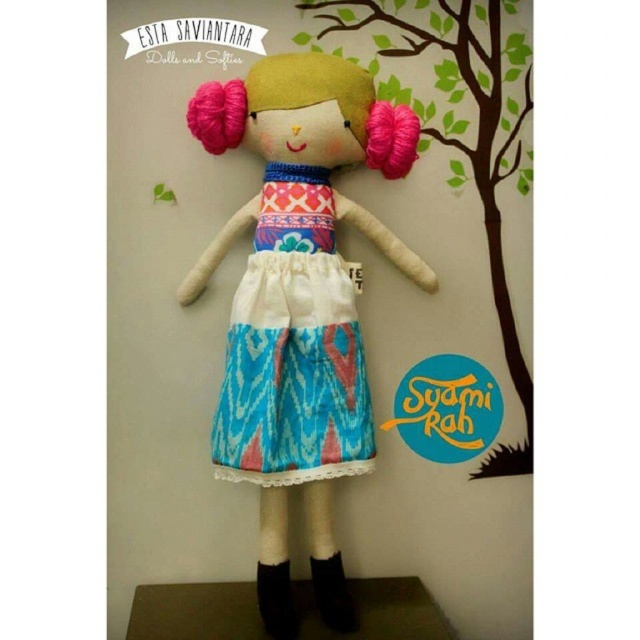
Question: Can you confirm if textured fabric doll at center is positioned below blue ikat apron at center?

Choices:
 (A) yes
 (B) no

Answer: (A)

Question: Which point is farther to the camera?

Choices:
 (A) textured fabric doll at center
 (B) blue ikat apron at center

Answer: (B)

Question: Can you confirm if textured fabric doll at center is smaller than blue ikat apron at center?

Choices:
 (A) no
 (B) yes

Answer: (A)

Question: Among these objects, which one is nearest to the camera?

Choices:
 (A) textured fabric doll at center
 (B) blue ikat apron at center

Answer: (A)

Question: From the image, what is the correct spatial relationship of textured fabric doll at center in relation to blue ikat apron at center?

Choices:
 (A) left
 (B) right

Answer: (B)

Question: Among these objects, which one is nearest to the camera?

Choices:
 (A) textured fabric doll at center
 (B) blue ikat apron at center

Answer: (A)